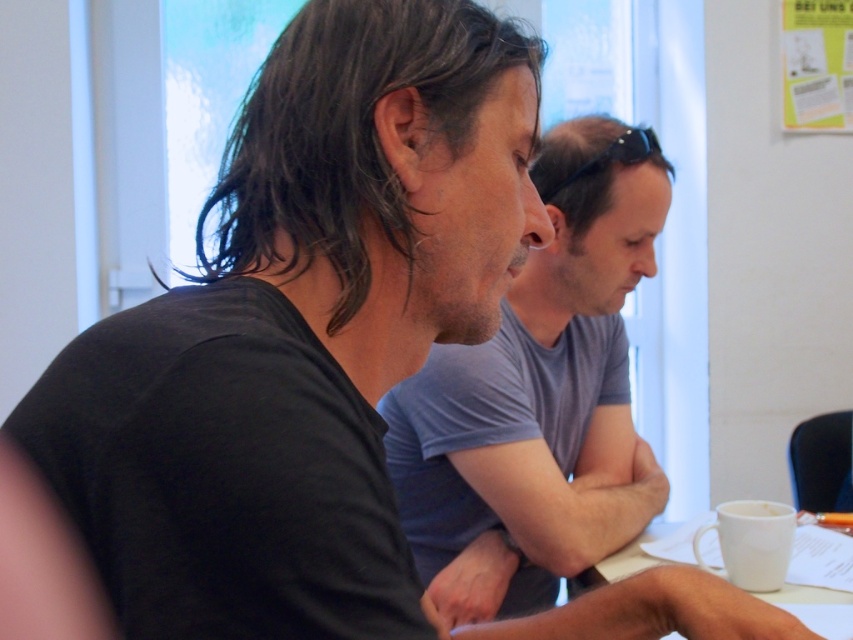
Between dark brown hair at upper right and white ceramic mug at lower right, which one appears on the right side from the viewer's perspective?

From the viewer's perspective, white ceramic mug at lower right appears more on the right side.

This screenshot has height=640, width=853. I want to click on dark brown hair at upper right, so click(589, 164).

In order to click on dark brown hair at upper right in this screenshot , I will do `click(589, 164)`.

Does dark brown wavy hair at center appear over white ceramic mug at lower right?

Correct, dark brown wavy hair at center is located above white ceramic mug at lower right.

Based on the photo, measure the distance between dark brown wavy hair at center and camera.

dark brown wavy hair at center and camera are 22.95 inches apart.

Is point (395, 193) in front of point (675, 636)?

Yes, it is.

Find the location of a particular element. The height and width of the screenshot is (640, 853). dark brown wavy hair at center is located at coordinates (347, 131).

Is dark brown wavy hair at center to the right of dark brown hair at upper right from the viewer's perspective?

Incorrect, dark brown wavy hair at center is not on the right side of dark brown hair at upper right.

Can you confirm if dark brown wavy hair at center is positioned below dark brown hair at upper right?

Correct, dark brown wavy hair at center is located below dark brown hair at upper right.

Describe the element at coordinates (347, 131) in the screenshot. I see `dark brown wavy hair at center` at that location.

The width and height of the screenshot is (853, 640). What are the coordinates of `dark brown wavy hair at center` in the screenshot? It's located at (347, 131).